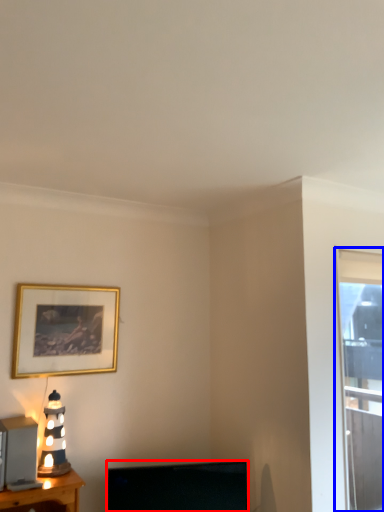
Question: Which object is further to the camera taking this photo, television (highlighted by a red box) or window (highlighted by a blue box)?

Choices:
 (A) television
 (B) window

Answer: (B)